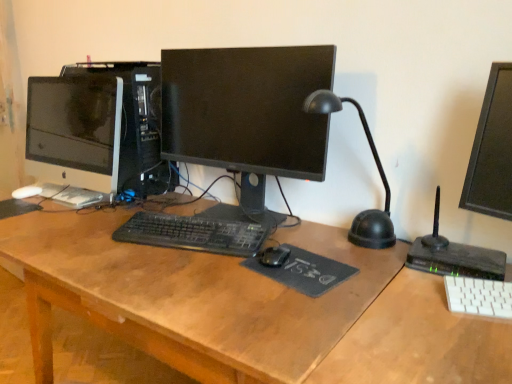
Find the location of a particular element. vacant space situated on the left part of black matte keyboard at center, which is counted as the second computer keyboard, starting from the front is located at coordinates (85, 240).